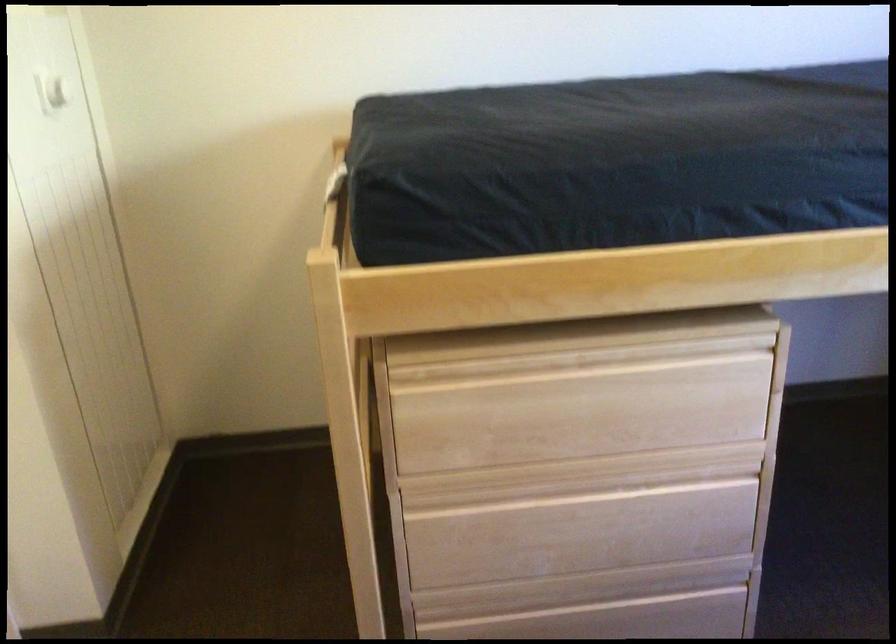
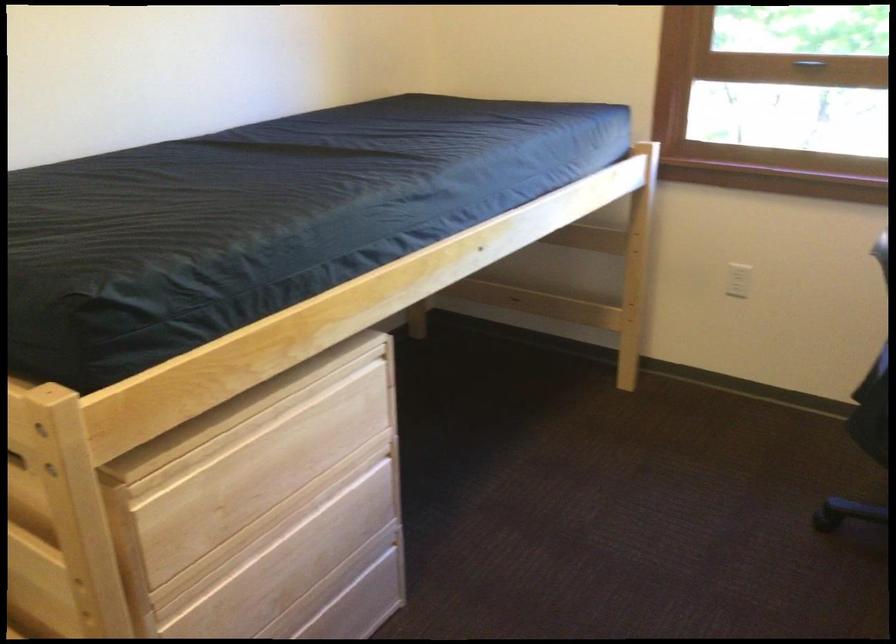
In the second image, find the point that corresponds to point (595, 399) in the first image.

(285, 448)